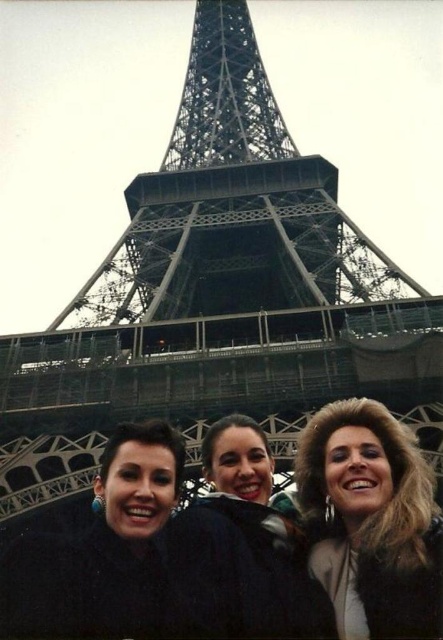
Is fuzzy brown hair at center shorter than black fuzzy jacket at lower left?

Incorrect, fuzzy brown hair at center's height does not fall short of black fuzzy jacket at lower left's.

What do you see at coordinates (373, 516) in the screenshot? This screenshot has height=640, width=443. I see `fuzzy brown hair at center` at bounding box center [373, 516].

This screenshot has width=443, height=640. What do you see at coordinates (373, 516) in the screenshot?
I see `fuzzy brown hair at center` at bounding box center [373, 516].

At what (x,y) coordinates should I click in order to perform the action: click on fuzzy brown hair at center. Please return your answer as a coordinate pair (x, y). Looking at the image, I should click on (373, 516).

Does fuzzy brown hair at center lie in front of matte black jacket at center?

Answer: That is True.

Locate an element on the screen. This screenshot has width=443, height=640. fuzzy brown hair at center is located at coordinates (373, 516).

Does black fuzzy jacket at lower left appear under matte black jacket at center?

Indeed, black fuzzy jacket at lower left is positioned under matte black jacket at center.

Is black fuzzy jacket at lower left further to camera compared to matte black jacket at center?

No, it is in front of matte black jacket at center.

Locate an element on the screen. This screenshot has width=443, height=640. black fuzzy jacket at lower left is located at coordinates (101, 548).